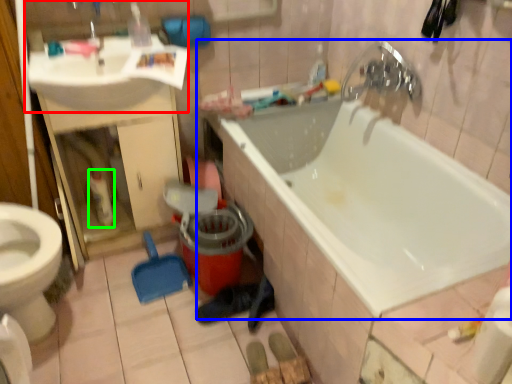
Question: Considering the real-world distances, which object is farthest from sink (highlighted by a red box)? bathtub (highlighted by a blue box) or cleaning product (highlighted by a green box)?

Choices:
 (A) bathtub
 (B) cleaning product

Answer: (A)